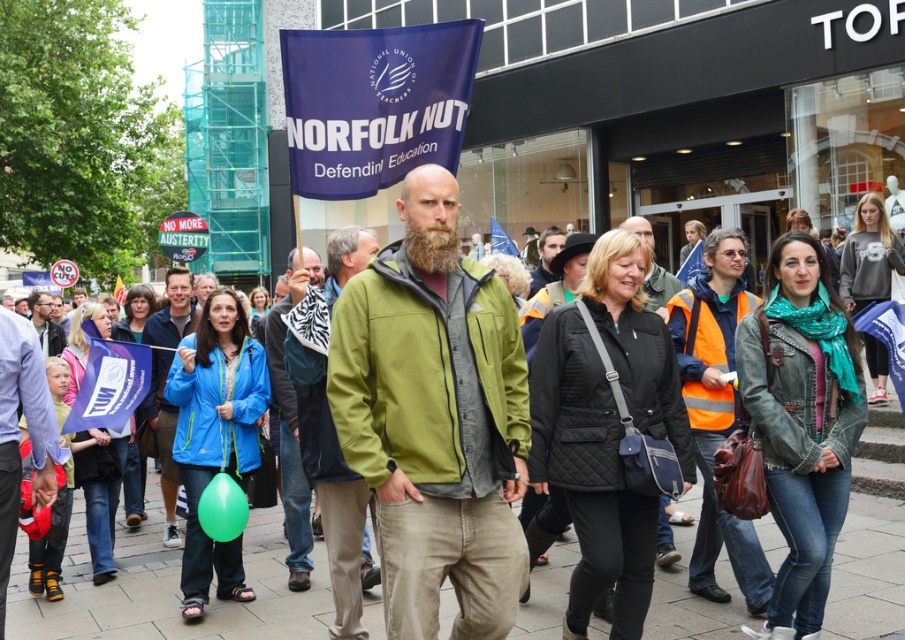
Is point (395, 362) positioned before point (49, 314)?

Yes.

Which is in front, point (493, 595) or point (40, 323)?

Point (493, 595)

This screenshot has height=640, width=905. I want to click on dark brown fuzzy beard at center, so click(435, 436).

The width and height of the screenshot is (905, 640). In order to click on dark brown fuzzy beard at center in this screenshot , I will do `click(435, 436)`.

Which of these two, dark brown fuzzy beard at center or brownwoodybeard at center, stands shorter?

brownwoodybeard at center is shorter.

The height and width of the screenshot is (640, 905). What do you see at coordinates (435, 436) in the screenshot? I see `dark brown fuzzy beard at center` at bounding box center [435, 436].

Does point (488, 285) come in front of point (443, 225)?

No, (488, 285) is behind (443, 225).

In order to click on dark brown fuzzy beard at center in this screenshot , I will do `click(435, 436)`.

Which of these two, smooth concrete pavement at center or green fabric scarf at center, stands shorter?

smooth concrete pavement at center

Is smooth concrete pavement at center thinner than green fabric scarf at center?

Correct, smooth concrete pavement at center's width is less than green fabric scarf at center's.

Is point (864, 593) farther from viewer compared to point (298, 516)?

No, (864, 593) is in front of (298, 516).

Locate an element on the screen. The image size is (905, 640). smooth concrete pavement at center is located at coordinates [x=168, y=592].